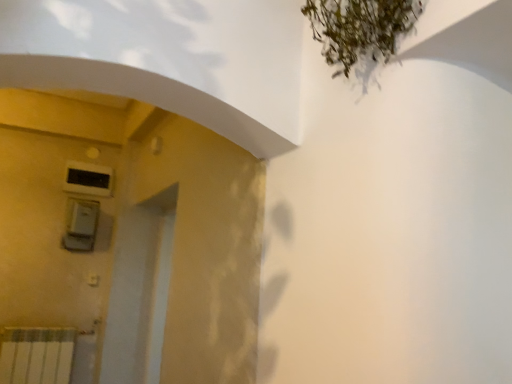
Find the location of a particular element. The width and height of the screenshot is (512, 384). satin silver switch at left is located at coordinates (80, 225).

The width and height of the screenshot is (512, 384). What do you see at coordinates (80, 225) in the screenshot? I see `satin silver switch at left` at bounding box center [80, 225].

Identify the location of black plastic air conditioning unit at upper left. This screenshot has width=512, height=384. [88, 179].

Measure the distance between black plastic air conditioning unit at upper left and camera.

The distance of black plastic air conditioning unit at upper left from camera is 9.49 feet.

The height and width of the screenshot is (384, 512). Describe the element at coordinates (88, 179) in the screenshot. I see `black plastic air conditioning unit at upper left` at that location.

Where is `satin silver switch at left`? satin silver switch at left is located at coordinates tap(80, 225).

Which is more to the left, black plastic air conditioning unit at upper left or satin silver switch at left?

From the viewer's perspective, black plastic air conditioning unit at upper left appears more on the left side.

Between black plastic air conditioning unit at upper left and satin silver switch at left, which one is positioned in front?

satin silver switch at left is closer to the camera.

Does point (81, 186) appear closer or farther from the camera than point (80, 245)?

Point (81, 186) is positioned farther from the camera compared to point (80, 245).

From the image's perspective, does black plastic air conditioning unit at upper left appear higher than satin silver switch at left?

Correct, black plastic air conditioning unit at upper left appears higher than satin silver switch at left in the image.

From a real-world perspective, which object stands above the other?

black plastic air conditioning unit at upper left, from a real-world perspective.

Which of these two, black plastic air conditioning unit at upper left or satin silver switch at left, is thinner?

black plastic air conditioning unit at upper left is thinner.

Does black plastic air conditioning unit at upper left have a greater height compared to satin silver switch at left?

No.

Can you confirm if black plastic air conditioning unit at upper left is smaller than satin silver switch at left?

Correct, black plastic air conditioning unit at upper left occupies less space than satin silver switch at left.

Could satin silver switch at left be considered to be inside black plastic air conditioning unit at upper left?

No, satin silver switch at left is not surrounded by black plastic air conditioning unit at upper left.

Would you say black plastic air conditioning unit at upper left is a long distance from satin silver switch at left?

Actually, black plastic air conditioning unit at upper left and satin silver switch at left are a little close together.

Is black plastic air conditioning unit at upper left facing away from satin silver switch at left?

black plastic air conditioning unit at upper left does not have its back to satin silver switch at left.

How many degrees apart are the facing directions of black plastic air conditioning unit at upper left and satin silver switch at left?

The angular difference between black plastic air conditioning unit at upper left and satin silver switch at left is 0.00829 degrees.

Identify the location of air conditioning above the satin silver switch at left (from a real-world perspective). (88, 179).

Which object is positioned more to the left, satin silver switch at left or black plastic air conditioning unit at upper left?

black plastic air conditioning unit at upper left is more to the left.

In the image, is satin silver switch at left positioned in front of or behind black plastic air conditioning unit at upper left?

Visually, satin silver switch at left is located in front of black plastic air conditioning unit at upper left.

Which is nearer, (x=98, y=211) or (x=94, y=191)?

The point (x=98, y=211) is closer.

From the image's perspective, which is below, satin silver switch at left or black plastic air conditioning unit at upper left?

satin silver switch at left appears lower in the image.

From a real-world perspective, relative to black plastic air conditioning unit at upper left, is satin silver switch at left vertically above or below?

satin silver switch at left is below black plastic air conditioning unit at upper left.

Looking at this image, is satin silver switch at left wider than black plastic air conditioning unit at upper left?

Yes, satin silver switch at left is wider than black plastic air conditioning unit at upper left.

Does satin silver switch at left have a lesser height compared to black plastic air conditioning unit at upper left?

Incorrect, the height of satin silver switch at left does not fall short of that of black plastic air conditioning unit at upper left.

Considering the relative sizes of satin silver switch at left and black plastic air conditioning unit at upper left in the image provided, is satin silver switch at left bigger than black plastic air conditioning unit at upper left?

Yes.

Is satin silver switch at left not inside black plastic air conditioning unit at upper left?

satin silver switch at left is positioned outside black plastic air conditioning unit at upper left.

Is satin silver switch at left not close to black plastic air conditioning unit at upper left?

No, satin silver switch at left is in close proximity to black plastic air conditioning unit at upper left.

Is satin silver switch at left oriented away from black plastic air conditioning unit at upper left?

No, black plastic air conditioning unit at upper left is not at the back of satin silver switch at left.

The height and width of the screenshot is (384, 512). What are the coordinates of `lift to the right of black plastic air conditioning unit at upper left` in the screenshot? It's located at (80, 225).

The width and height of the screenshot is (512, 384). Identify the location of lift on the right of black plastic air conditioning unit at upper left. (80, 225).

Where is `lift directly beneath the black plastic air conditioning unit at upper left (from a real-world perspective)`? This screenshot has height=384, width=512. lift directly beneath the black plastic air conditioning unit at upper left (from a real-world perspective) is located at coordinates (80, 225).